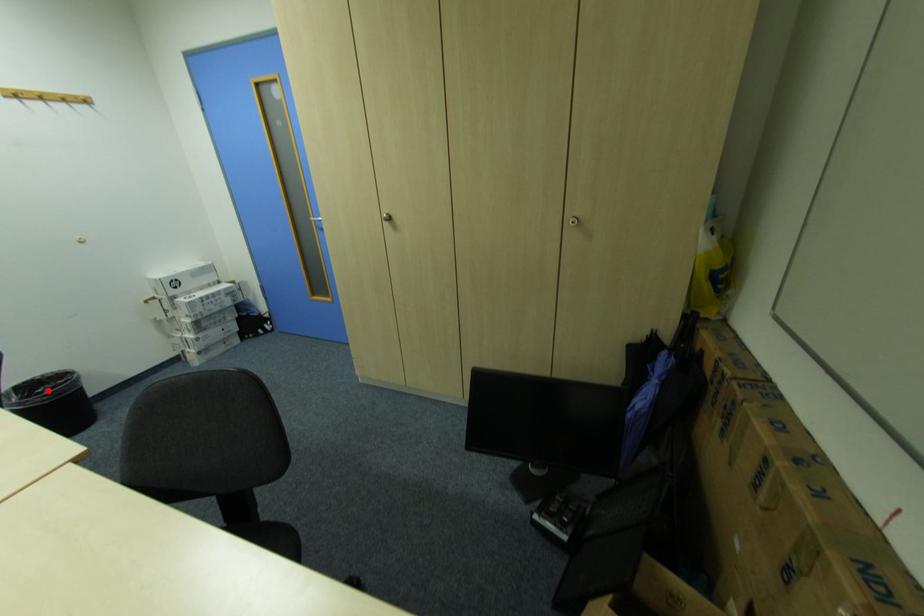
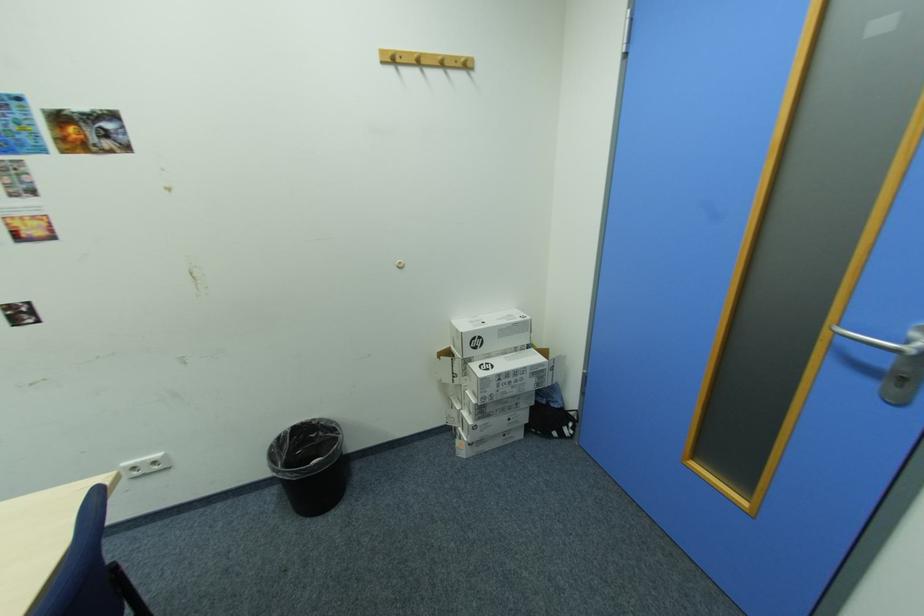
Question: A red point is marked in image1. In image2, is the corresponding 3D point closer to the camera or farther? Reply with the corresponding letter.

Choices:
 (A) The corresponding 3D point is closer.
 (B) The corresponding 3D point is farther.

Answer: (A)